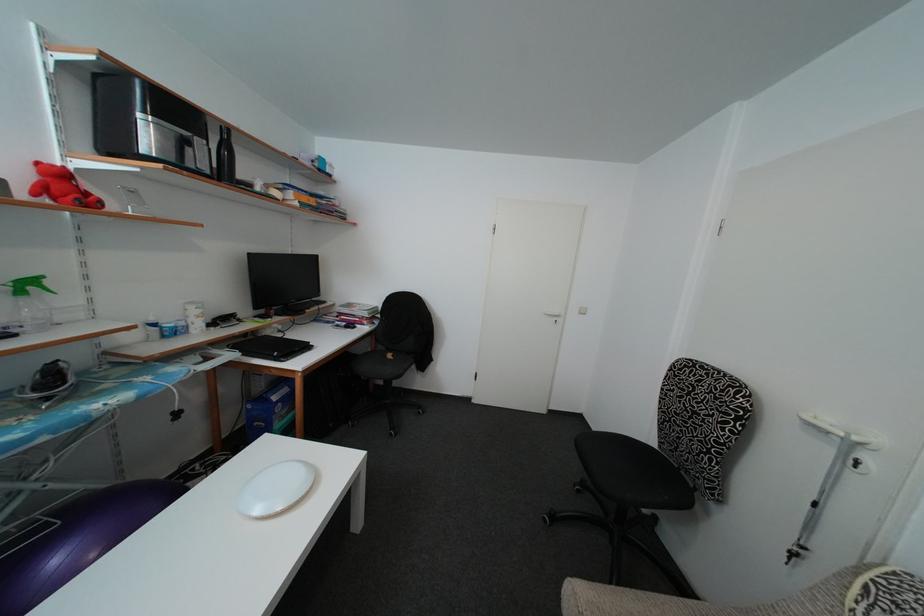
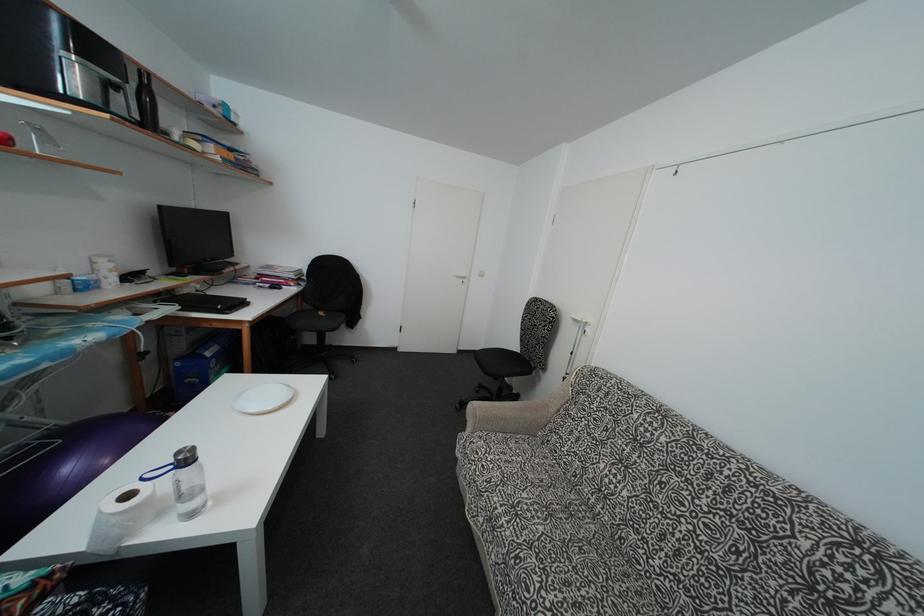
In the second image, find the point that corresponds to the point at 88,493 in the first image.

(58, 429)